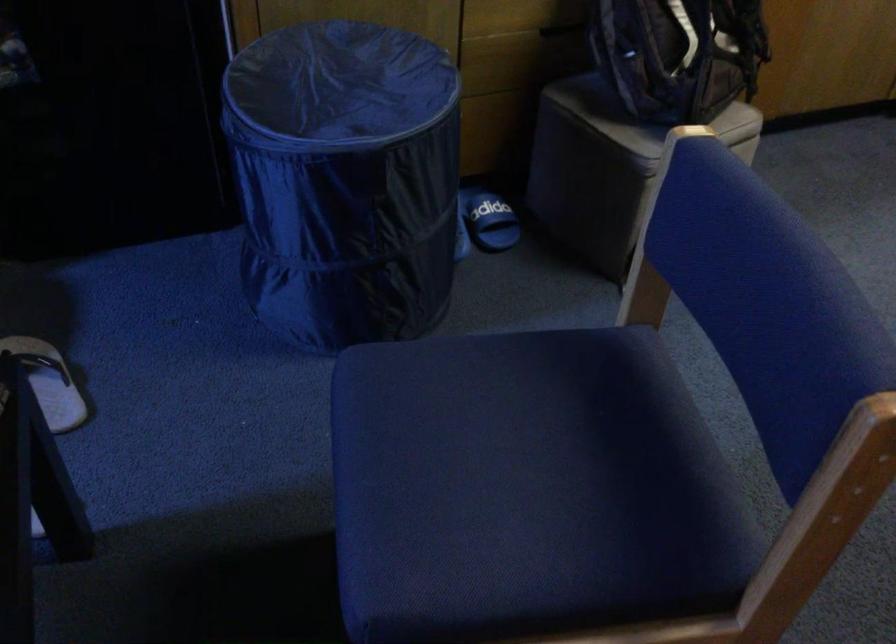
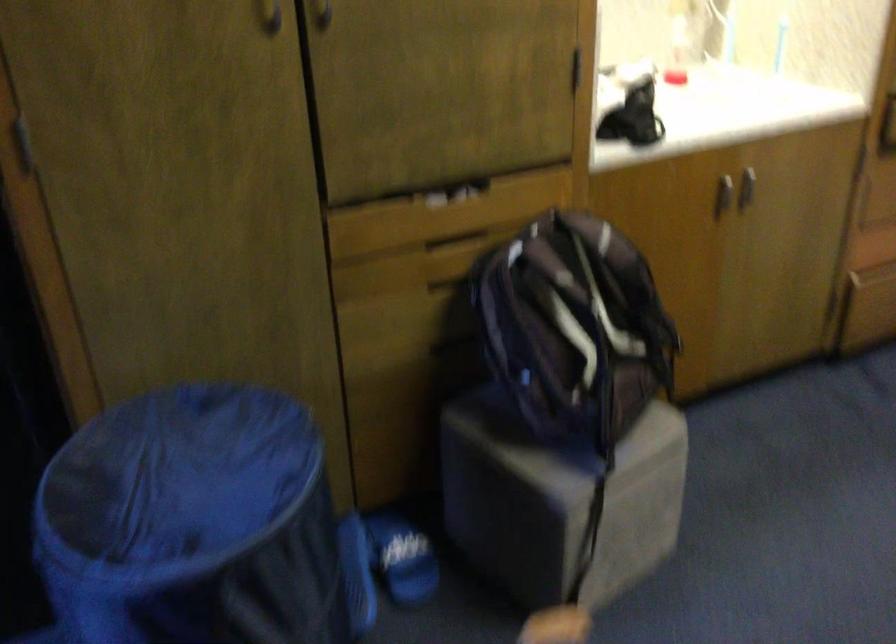
Locate, in the second image, the point that corresponds to pixel 644 117 in the first image.

(556, 442)